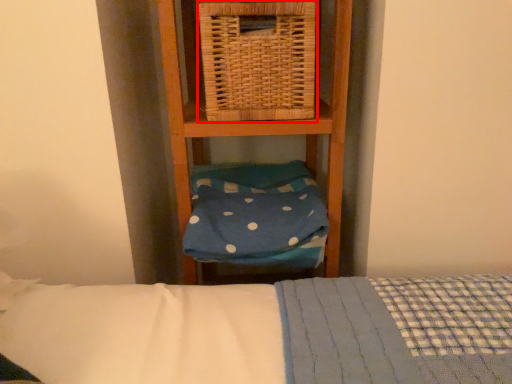
Question: From the image's perspective, what is the correct spatial relationship of picnic basket (annotated by the red box) in relation to pillow?

Choices:
 (A) above
 (B) below

Answer: (A)